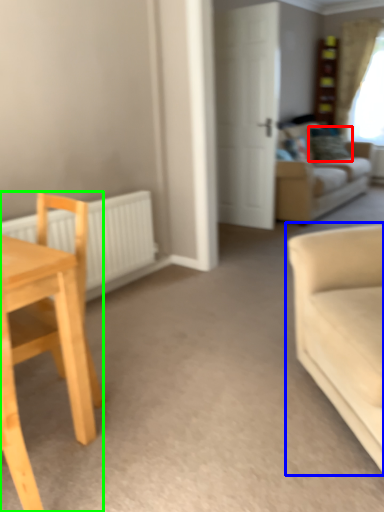
Question: Which object is the farthest from pillow (highlighted by a red box)? Choose among these: studio couch (highlighted by a blue box) or chair (highlighted by a green box).

Choices:
 (A) studio couch
 (B) chair

Answer: (B)